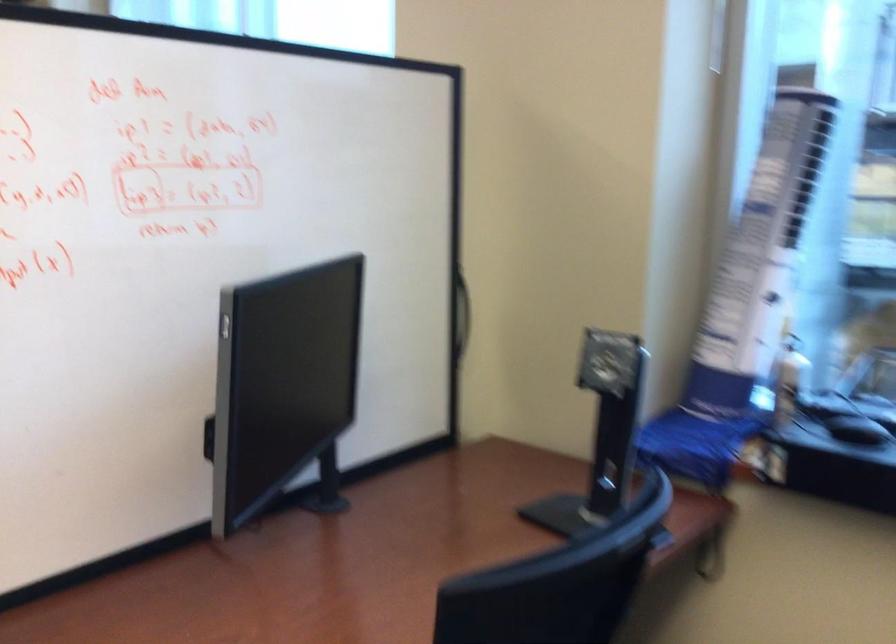
Find where to push the silver monitor button. Please return your answer as a coordinate pair (x, y).

(225, 326)